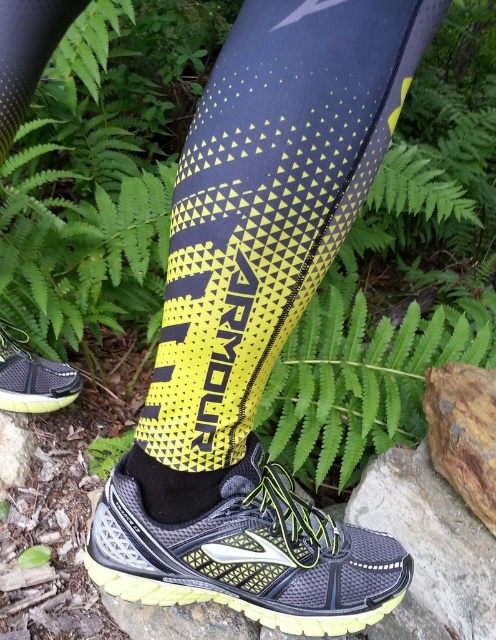
Is point (17, 372) farther from viewer compared to point (208, 481)?

Yes, point (17, 372) is farther from viewer.

Between point (57, 381) and point (171, 493), which one is positioned behind?

Positioned behind is point (57, 381).

Which is in front, point (25, 403) or point (166, 515)?

Point (166, 515) is more forward.

The image size is (496, 640). Identify the location of matte black shoe at lower left. (33, 376).

Is matte black shoe at lower center to the right of matte black shoe at lower left from the viewer's perspective?

Correct, you'll find matte black shoe at lower center to the right of matte black shoe at lower left.

Is matte black shoe at lower center bigger than matte black shoe at lower left?

Indeed, matte black shoe at lower center has a larger size compared to matte black shoe at lower left.

Is point (248, 582) closer to camera compared to point (20, 349)?

Yes, it is in front of point (20, 349).

The width and height of the screenshot is (496, 640). In order to click on matte black shoe at lower center in this screenshot , I will do `click(248, 554)`.

Where is `matte black shoe at lower center`? matte black shoe at lower center is located at coordinates (248, 554).

Can you confirm if matte black shoe at lower center is positioned to the right of black mesh sock at lower center?

Indeed, matte black shoe at lower center is positioned on the right side of black mesh sock at lower center.

Between point (245, 604) and point (169, 515), which one is positioned in front?

Point (169, 515)

The height and width of the screenshot is (640, 496). Identify the location of matte black shoe at lower center. (248, 554).